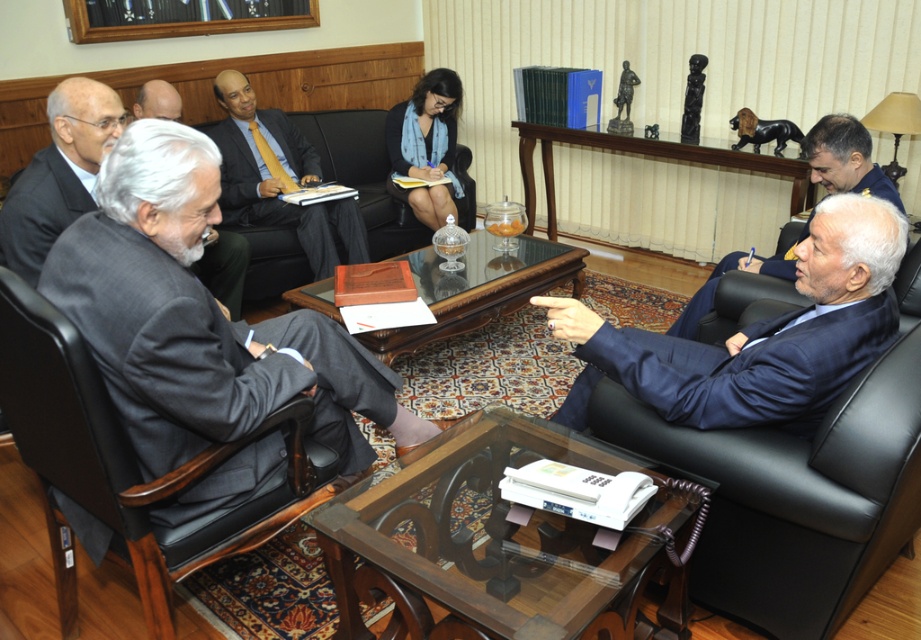
Question: Does blue suit at right appear under matte black suit at center?

Choices:
 (A) yes
 (B) no

Answer: (A)

Question: Which point appears farthest from the camera in this image?

Choices:
 (A) (555, 627)
 (B) (372, 154)
 (C) (546, 186)

Answer: (C)

Question: Which object is closer to the camera taking this photo?

Choices:
 (A) black leather armchair at right
 (B) dark gray leather armchair at left

Answer: (B)

Question: Can you confirm if glasswoodentable at center is wider than matte black suit at left?

Choices:
 (A) yes
 (B) no

Answer: (A)

Question: Based on their relative distances, which object is farther from the transparent glass table at center?

Choices:
 (A) dark blue suit at right
 (B) glassmaterial/texturetable at center
 (C) glasswoodentable at center
 (D) blue suit at right

Answer: (B)

Question: Is black leather armchair at right closer to the viewer compared to dark blue suit at right?

Choices:
 (A) yes
 (B) no

Answer: (A)